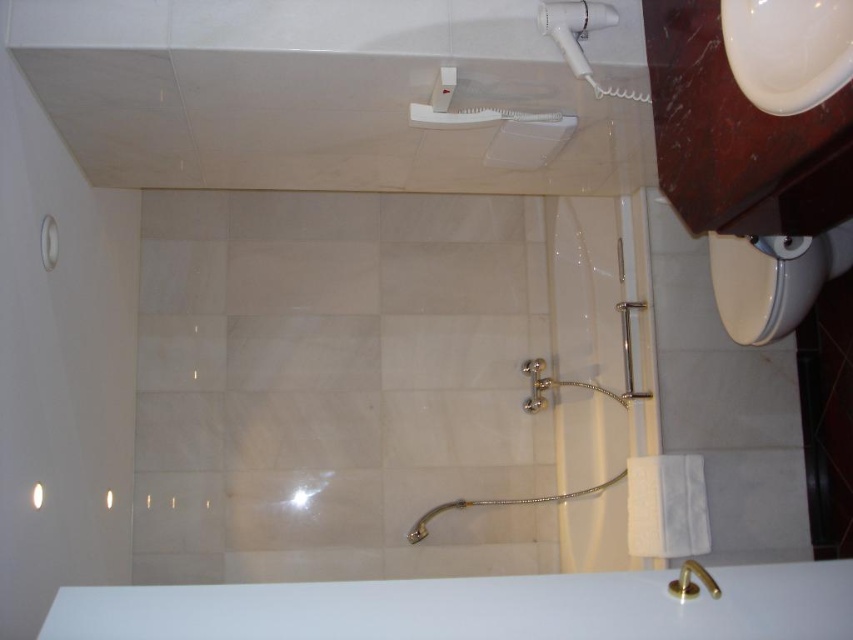
Which is more to the right, white glossy sink at upper right or white plastic hairdryer at upper right?

Positioned to the right is white glossy sink at upper right.

Can you confirm if white glossy sink at upper right is positioned below white plastic hairdryer at upper right?

Correct, white glossy sink at upper right is located below white plastic hairdryer at upper right.

Which is in front, point (817, 10) or point (592, 26)?

Point (817, 10)

The image size is (853, 640). Identify the location of white glossy sink at upper right. (787, 51).

What do you see at coordinates (473, 608) in the screenshot? The image size is (853, 640). I see `white glossy bath at lower center` at bounding box center [473, 608].

Does white glossy bath at lower center have a smaller size compared to white glossy toilet bowl at lower right?

Yes.

The height and width of the screenshot is (640, 853). Find the location of `white glossy bath at lower center`. white glossy bath at lower center is located at coordinates (473, 608).

Can you confirm if white glossy sink at upper right is positioned below gold metallic faucet at lower center?

Incorrect, white glossy sink at upper right is not positioned below gold metallic faucet at lower center.

Can you confirm if white glossy sink at upper right is wider than gold metallic faucet at lower center?

No, white glossy sink at upper right is not wider than gold metallic faucet at lower center.

Is point (734, 74) closer to camera compared to point (705, 576)?

Yes, point (734, 74) is closer to viewer.

Locate an element on the screen. white glossy sink at upper right is located at coordinates (787, 51).